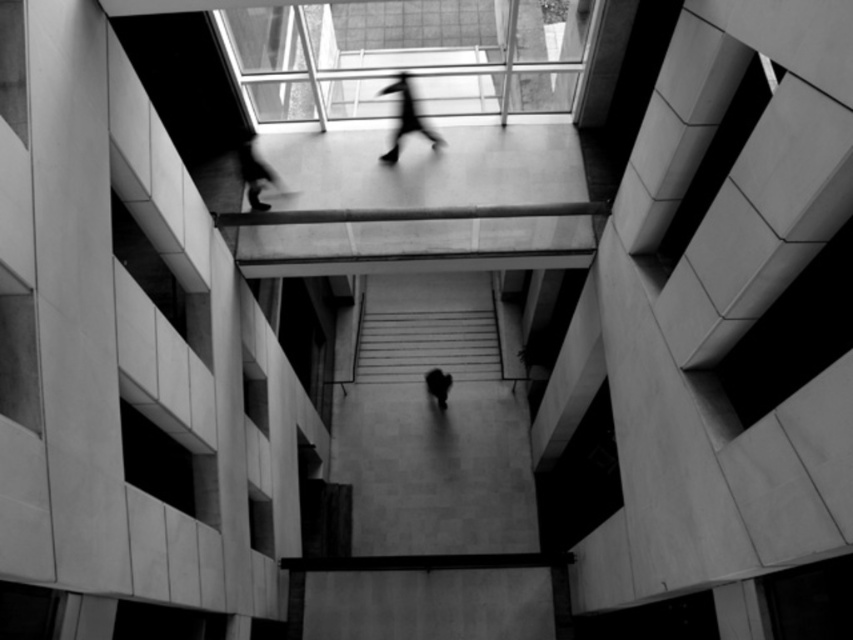
Does point (370, 371) come behind point (440, 408)?

Yes, point (370, 371) is behind point (440, 408).

Looking at this image, who is higher up, smooth concrete stairs at center or dark figure at center?

smooth concrete stairs at center is higher up.

At what (x,y) coordinates should I click in order to perform the action: click on smooth concrete stairs at center. Please return your answer as a coordinate pair (x, y). This screenshot has width=853, height=640. Looking at the image, I should click on (427, 326).

Can you confirm if smooth concrete stairs at center is shorter than silhouette figure at upper center?

No.

Is smooth concrete stairs at center below silhouette figure at upper center?

Correct, smooth concrete stairs at center is located below silhouette figure at upper center.

In order to click on smooth concrete stairs at center in this screenshot , I will do `click(427, 326)`.

Can you confirm if silhouette figure at upper center is smaller than blurred figure at upper center?

Correct, silhouette figure at upper center occupies less space than blurred figure at upper center.

Between silhouette figure at upper center and blurred figure at upper center, which one appears on the right side from the viewer's perspective?

From the viewer's perspective, blurred figure at upper center appears more on the right side.

Does point (248, 176) come farther from viewer compared to point (416, 124)?

No, it is not.

In order to click on silhouette figure at upper center in this screenshot , I will do `click(253, 170)`.